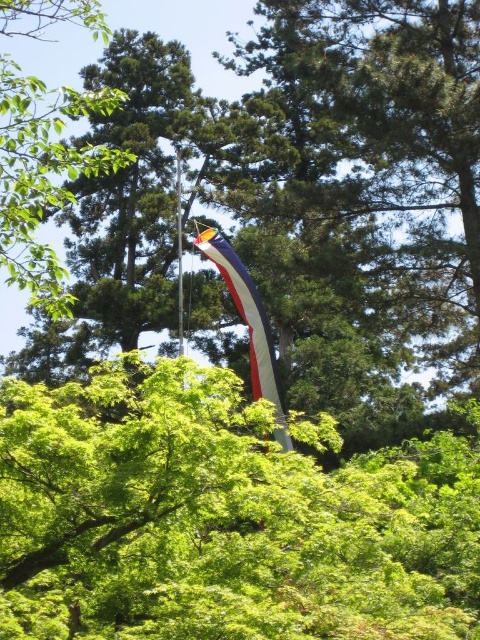
Question: Which of the following is the closest to the observer?

Choices:
 (A) (228, 468)
 (B) (206, 253)

Answer: (A)

Question: Can you confirm if green leafy tree at center is positioned to the right of green leafy tree at upper left?

Choices:
 (A) no
 (B) yes

Answer: (B)

Question: Which object is farther from the camera taking this photo?

Choices:
 (A) green leafy tree at upper left
 (B) white fabric flag at center
 (C) green leafy tree at center

Answer: (B)

Question: Which object appears farthest from the camera in this image?

Choices:
 (A) green leafy tree at center
 (B) green leafy tree at upper left

Answer: (B)

Question: Can you confirm if green leafy tree at center is thinner than green leafy tree at upper left?

Choices:
 (A) no
 (B) yes

Answer: (B)

Question: Does green leafy tree at center appear on the left side of green leafy tree at upper left?

Choices:
 (A) no
 (B) yes

Answer: (A)